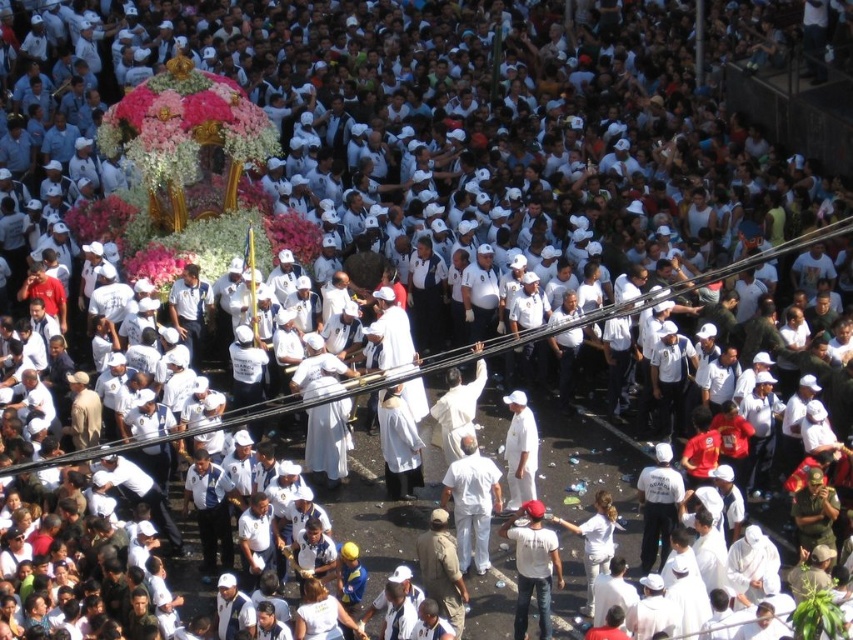
This screenshot has width=853, height=640. What do you see at coordinates (473, 502) in the screenshot?
I see `white matte clothing at center` at bounding box center [473, 502].

Does white matte clothing at center have a lesser width compared to white cotton shirt at lower right?

No.

The height and width of the screenshot is (640, 853). I want to click on white matte clothing at center, so click(473, 502).